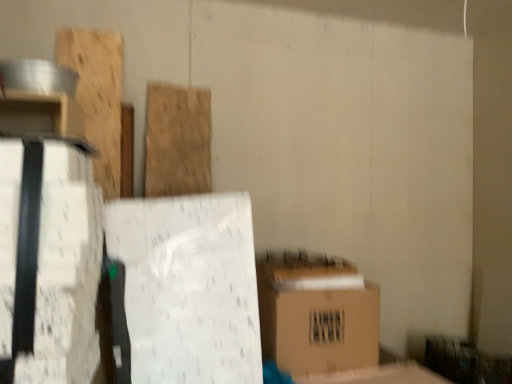
The width and height of the screenshot is (512, 384). What do you see at coordinates (49, 262) in the screenshot? I see `white matte cardboard box at left` at bounding box center [49, 262].

I want to click on white matte cardboard box at left, so click(x=49, y=262).

What do you see at coordinates (316, 313) in the screenshot? This screenshot has width=512, height=384. I see `brown cardboard box at lower right` at bounding box center [316, 313].

The height and width of the screenshot is (384, 512). Describe the element at coordinates (97, 96) in the screenshot. I see `wooden plank at upper left, the first wood from the left` at that location.

Where is `natural wood plank at center, the 1th wood viewed from the right`? The image size is (512, 384). natural wood plank at center, the 1th wood viewed from the right is located at coordinates (177, 140).

This screenshot has height=384, width=512. In order to click on box below the natural wood plank at center, marked as the second wood in a left-to-right arrangement (from the image's perspective) in this screenshot , I will do `click(316, 313)`.

From the image's perspective, is brown cardboard box at lower right located beneath natural wood plank at center, the 1th wood viewed from the right?

Yes.

Does brown cardboard box at lower right have a greater height compared to natural wood plank at center, the 1th wood viewed from the right?

No.

Can you confirm if wooden plank at upper left, marked as the second wood in a right-to-left arrangement, is wider than brown cardboard box at lower right?

No.

From the picture: Is wooden plank at upper left, the first wood from the left, at the left side of brown cardboard box at lower right?

Yes, wooden plank at upper left, the first wood from the left, is to the left of brown cardboard box at lower right.

From the image's perspective, between wooden plank at upper left, marked as the second wood in a right-to-left arrangement, and brown cardboard box at lower right, who is located below?

brown cardboard box at lower right is shown below in the image.

From the picture: Is wooden plank at upper left, marked as the second wood in a right-to-left arrangement, in contact with brown cardboard box at lower right?

No, wooden plank at upper left, marked as the second wood in a right-to-left arrangement, is not next to brown cardboard box at lower right.

Locate an element on the screen. cardboard box in front of the natural wood plank at center, marked as the second wood in a left-to-right arrangement is located at coordinates (49, 262).

Can you tell me how much white matte cardboard box at left and natural wood plank at center, the 1th wood viewed from the right, differ in facing direction?

There is a 5.05-degree angle between the facing directions of white matte cardboard box at left and natural wood plank at center, the 1th wood viewed from the right.

From a real-world perspective, is white matte cardboard box at left physically above natural wood plank at center, marked as the second wood in a left-to-right arrangement?

No.

Is point (31, 188) closer to camera compared to point (147, 156)?

Yes, it is.

From a real-world perspective, which object rests below the other?

white matte cardboard box at left.

Considering the relative positions of natural wood plank at center, the 1th wood viewed from the right, and white matte cardboard box at left in the image provided, is natural wood plank at center, the 1th wood viewed from the right, to the right of white matte cardboard box at left from the viewer's perspective?

Yes.

Which is correct: natural wood plank at center, the 1th wood viewed from the right, is inside white matte cardboard box at left, or outside of it?

natural wood plank at center, the 1th wood viewed from the right, exists outside the volume of white matte cardboard box at left.

Is brown cardboard box at lower right looking in the opposite direction of wooden plank at upper left, the first wood from the left?

brown cardboard box at lower right does not have its back to wooden plank at upper left, the first wood from the left.

Is brown cardboard box at lower right placed right next to wooden plank at upper left, marked as the second wood in a right-to-left arrangement?

brown cardboard box at lower right and wooden plank at upper left, marked as the second wood in a right-to-left arrangement, are clearly separated.

Could you tell me if white matte cardboard box at left is facing wooden plank at upper left, the first wood from the left?

No.

Which of these two, white matte cardboard box at left or wooden plank at upper left, the first wood from the left, is thinner?

Thinner between the two is wooden plank at upper left, the first wood from the left.

In the scene shown: Based on their positions, is white matte cardboard box at left located to the left or right of wooden plank at upper left, the first wood from the left?

Clearly, white matte cardboard box at left is on the right of wooden plank at upper left, the first wood from the left, in the image.

I want to click on cardboard box below the wooden plank at upper left, marked as the second wood in a right-to-left arrangement (from the image's perspective), so click(x=49, y=262).

From the image's perspective, relative to natural wood plank at center, marked as the second wood in a left-to-right arrangement, is wooden plank at upper left, the first wood from the left, above or below?

wooden plank at upper left, the first wood from the left, is above natural wood plank at center, marked as the second wood in a left-to-right arrangement.

Which of these two, wooden plank at upper left, marked as the second wood in a right-to-left arrangement, or natural wood plank at center, the 1th wood viewed from the right, is wider?

Wider between the two is wooden plank at upper left, marked as the second wood in a right-to-left arrangement.

Is natural wood plank at center, the 1th wood viewed from the right, at the back of wooden plank at upper left, marked as the second wood in a right-to-left arrangement?

That's not correct — wooden plank at upper left, marked as the second wood in a right-to-left arrangement, is not looking away from natural wood plank at center, the 1th wood viewed from the right.

Is wooden plank at upper left, marked as the second wood in a right-to-left arrangement, situated inside natural wood plank at center, marked as the second wood in a left-to-right arrangement, or outside?

wooden plank at upper left, marked as the second wood in a right-to-left arrangement, exists outside the volume of natural wood plank at center, marked as the second wood in a left-to-right arrangement.

There is a brown cardboard box at lower right. Identify the location of the 1st wood above it (from the image's perspective). (177, 140).

Where is `wood that is the 2nd object to the left of the brown cardboard box at lower right, starting at the anchor`? wood that is the 2nd object to the left of the brown cardboard box at lower right, starting at the anchor is located at coordinates (97, 96).

Considering their positions, is natural wood plank at center, marked as the second wood in a left-to-right arrangement, positioned further to wooden plank at upper left, marked as the second wood in a right-to-left arrangement, than brown cardboard box at lower right?

brown cardboard box at lower right is positioned further to the anchor wooden plank at upper left, marked as the second wood in a right-to-left arrangement.

When comparing their distances from natural wood plank at center, marked as the second wood in a left-to-right arrangement, does white matte cardboard box at left or wooden plank at upper left, marked as the second wood in a right-to-left arrangement, seem further?

The object further to natural wood plank at center, marked as the second wood in a left-to-right arrangement, is white matte cardboard box at left.

When comparing their distances from natural wood plank at center, the 1th wood viewed from the right, does brown cardboard box at lower right or white matte cardboard box at left seem closer?

brown cardboard box at lower right is closer to natural wood plank at center, the 1th wood viewed from the right.

Considering their positions, is wooden plank at upper left, the first wood from the left, positioned closer to white matte cardboard box at left than natural wood plank at center, the 1th wood viewed from the right?

wooden plank at upper left, the first wood from the left, is positioned closer to the anchor white matte cardboard box at left.

In the scene shown: When comparing their distances from natural wood plank at center, the 1th wood viewed from the right, does wooden plank at upper left, marked as the second wood in a right-to-left arrangement, or brown cardboard box at lower right seem closer?

The object closer to natural wood plank at center, the 1th wood viewed from the right, is wooden plank at upper left, marked as the second wood in a right-to-left arrangement.

Considering their positions, is wooden plank at upper left, marked as the second wood in a right-to-left arrangement, positioned closer to brown cardboard box at lower right than natural wood plank at center, marked as the second wood in a left-to-right arrangement?

natural wood plank at center, marked as the second wood in a left-to-right arrangement, is positioned closer to the anchor brown cardboard box at lower right.

Which object lies nearer to the anchor point brown cardboard box at lower right, white matte cardboard box at left or natural wood plank at center, marked as the second wood in a left-to-right arrangement?

natural wood plank at center, marked as the second wood in a left-to-right arrangement, lies closer to brown cardboard box at lower right than the other object.

Based on their spatial positions, is white matte cardboard box at left or brown cardboard box at lower right further from wooden plank at upper left, marked as the second wood in a right-to-left arrangement?

Based on the image, brown cardboard box at lower right appears to be further to wooden plank at upper left, marked as the second wood in a right-to-left arrangement.

Where is `wood between white matte cardboard box at left and natural wood plank at center, marked as the second wood in a left-to-right arrangement, in the front-back direction`? The height and width of the screenshot is (384, 512). wood between white matte cardboard box at left and natural wood plank at center, marked as the second wood in a left-to-right arrangement, in the front-back direction is located at coordinates (97, 96).

Find the location of `box between white matte cardboard box at left and wooden plank at upper left, marked as the second wood in a right-to-left arrangement, along the z-axis`. box between white matte cardboard box at left and wooden plank at upper left, marked as the second wood in a right-to-left arrangement, along the z-axis is located at coordinates (316, 313).

Where is `box between white matte cardboard box at left and natural wood plank at center, marked as the second wood in a left-to-right arrangement, from front to back`? This screenshot has width=512, height=384. box between white matte cardboard box at left and natural wood plank at center, marked as the second wood in a left-to-right arrangement, from front to back is located at coordinates (316, 313).

I want to click on wood that lies between wooden plank at upper left, marked as the second wood in a right-to-left arrangement, and brown cardboard box at lower right from top to bottom, so click(177, 140).